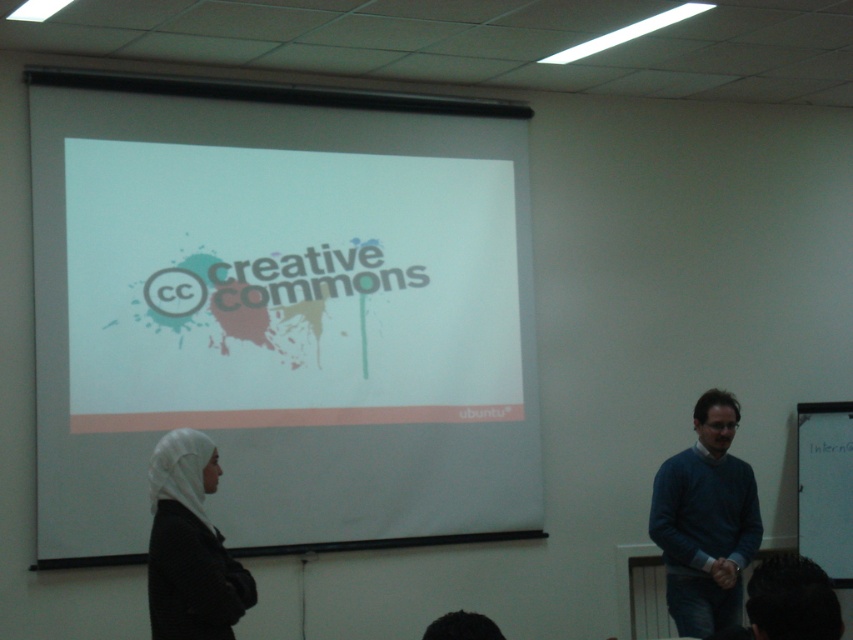
Which is above, white matte projection screen at center or white matte hijab at lower left?

Positioned higher is white matte projection screen at center.

Which of these two, white matte projection screen at center or white matte hijab at lower left, stands shorter?

Standing shorter between the two is white matte hijab at lower left.

Which is in front, point (115, 387) or point (219, 616)?

Point (219, 616) is in front.

Locate an element on the screen. The height and width of the screenshot is (640, 853). white matte projection screen at center is located at coordinates (281, 314).

Between white matte projection screen at center and blue sweater at right, which one appears on the left side from the viewer's perspective?

Positioned to the left is white matte projection screen at center.

Identify the location of white matte projection screen at center. The width and height of the screenshot is (853, 640). (281, 314).

The height and width of the screenshot is (640, 853). Identify the location of white matte projection screen at center. (281, 314).

Does blue sweater at right have a larger size compared to white matte hijab at lower left?

Yes.

Can you confirm if blue sweater at right is shorter than white matte hijab at lower left?

No.

Between point (659, 502) and point (184, 605), which one is positioned in front?

Positioned in front is point (184, 605).

This screenshot has height=640, width=853. I want to click on blue sweater at right, so click(x=705, y=522).